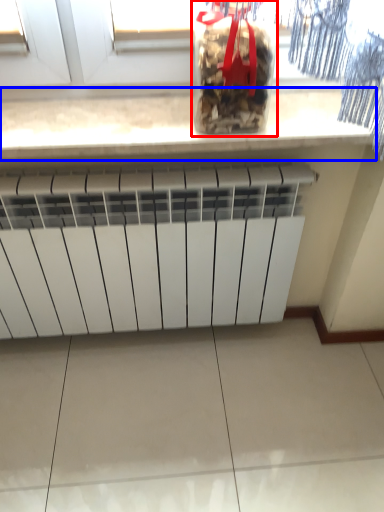
Question: Among these objects, which one is farthest to the camera, wine bottle (highlighted by a red box) or countertop (highlighted by a blue box)?

Choices:
 (A) wine bottle
 (B) countertop

Answer: (B)